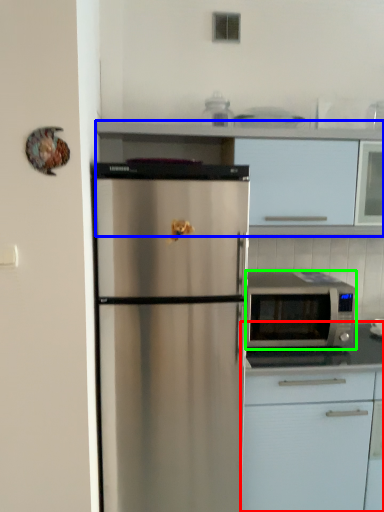
Question: Estimate the real-world distances between objects in this image. Which object is closer to cabinetry (highlighted by a red box), cabinetry (highlighted by a blue box) or microwave oven (highlighted by a green box)?

Choices:
 (A) cabinetry
 (B) microwave oven

Answer: (B)